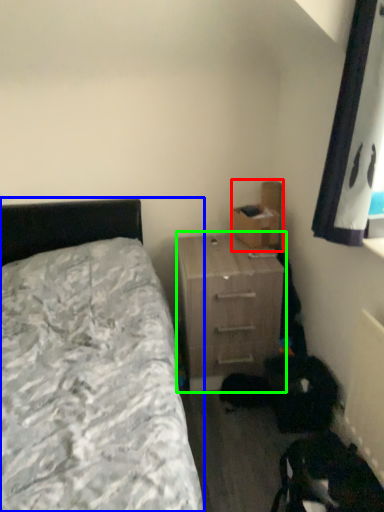
Question: Based on their relative distances, which object is nearer to cardboard box (highlighted by a red box)? Choose from bed (highlighted by a blue box) and nightstand (highlighted by a green box).

Choices:
 (A) bed
 (B) nightstand

Answer: (B)